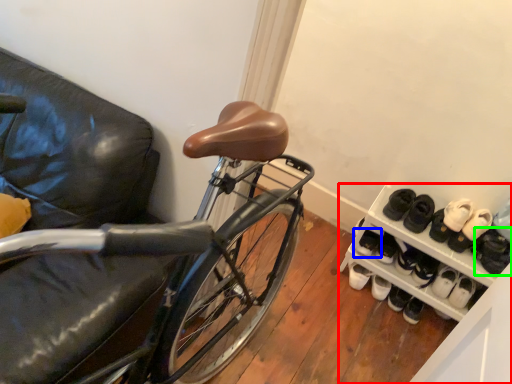
Question: Which object is positioned closest to cabinetry (highlighted by a red box)? Select from footwear (highlighted by a blue box) and footwear (highlighted by a green box).

Choices:
 (A) footwear
 (B) footwear

Answer: (A)